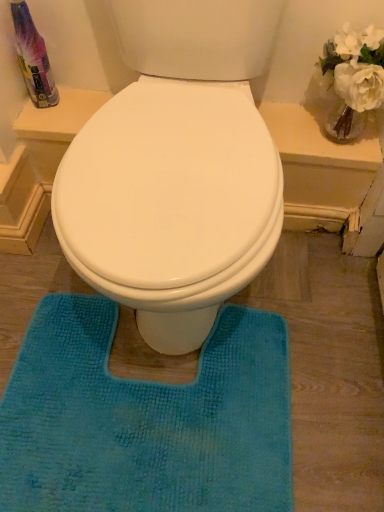
Question: From a real-world perspective, is teal plush bath mat at center physically located above or below translucent plastic spray bottle at upper left?

Choices:
 (A) above
 (B) below

Answer: (B)

Question: Is point (26, 506) positioned closer to the camera than point (21, 50)?

Choices:
 (A) closer
 (B) farther

Answer: (A)

Question: Considering the positions of teal plush bath mat at center and translucent plastic spray bottle at upper left in the image, is teal plush bath mat at center wider or thinner than translucent plastic spray bottle at upper left?

Choices:
 (A) thin
 (B) wide

Answer: (B)

Question: From the image's perspective, is translucent plastic spray bottle at upper left above or below teal plush bath mat at center?

Choices:
 (A) below
 (B) above

Answer: (B)

Question: Is translucent plastic spray bottle at upper left wider or thinner than teal plush bath mat at center?

Choices:
 (A) wide
 (B) thin

Answer: (B)

Question: Does point (46, 60) appear closer or farther from the camera than point (49, 385)?

Choices:
 (A) closer
 (B) farther

Answer: (B)

Question: Would you say translucent plastic spray bottle at upper left is to the left or to the right of teal plush bath mat at center in the picture?

Choices:
 (A) right
 (B) left

Answer: (B)